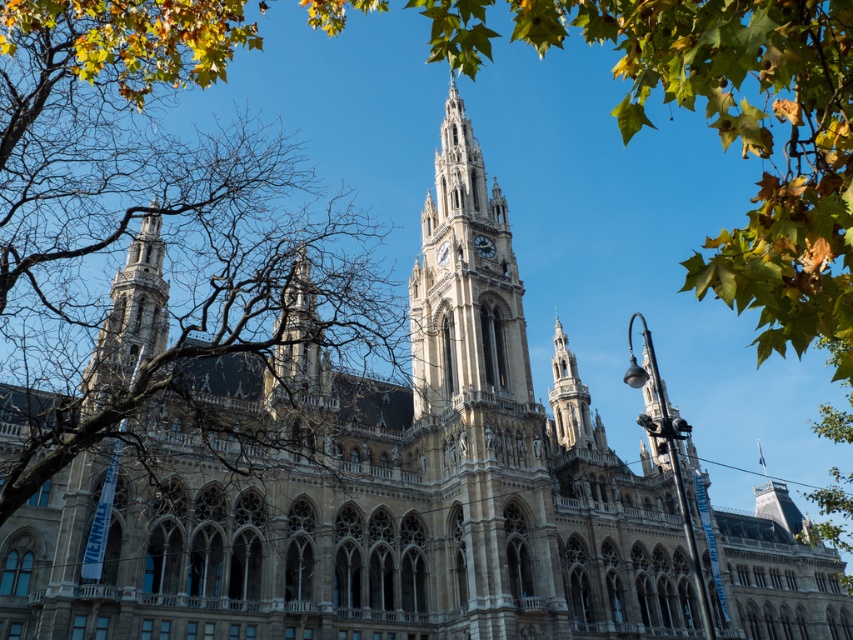
In the scene shown: Between stone clock tower at center and stone tower at center, which one has more height?

stone clock tower at center

Can you confirm if stone clock tower at center is positioned to the right of stone tower at center?

Indeed, stone clock tower at center is positioned on the right side of stone tower at center.

Which is behind, point (434, 243) or point (312, 323)?

Positioned behind is point (434, 243).

You are a GUI agent. You are given a task and a screenshot of the screen. Output one action in this format:
    pyautogui.click(x=<x>, y=<y>)
    Task: Click on the stone clock tower at center
    The height and width of the screenshot is (640, 853).
    Given the screenshot: What is the action you would take?
    pyautogui.click(x=463, y=284)

The image size is (853, 640). Find the location of `stone clock tower at center`. stone clock tower at center is located at coordinates (463, 284).

Does stone clock tower at center lie in front of golden stone tower at center?

That is True.

Does point (445, 342) come closer to viewer compared to point (564, 346)?

That is True.

The height and width of the screenshot is (640, 853). I want to click on stone clock tower at center, so click(463, 284).

Is stone clock tower at center positioned behind silver metallic clock at center?

No, stone clock tower at center is closer to the viewer.

Between stone clock tower at center and silver metallic clock at center, which one is positioned lower?

silver metallic clock at center is below.

Image resolution: width=853 pixels, height=640 pixels. In order to click on stone clock tower at center in this screenshot , I will do `click(463, 284)`.